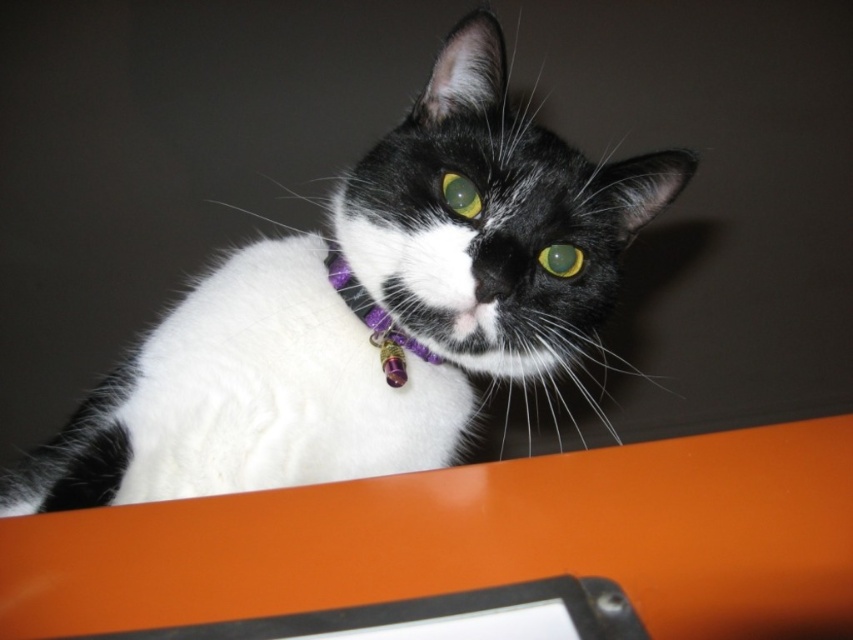
Question: Does orange glossy table at upper center appear on the left side of green glossy eye at center?

Choices:
 (A) yes
 (B) no

Answer: (A)

Question: Is white fur cat at center thinner than purple fabric collar at center?

Choices:
 (A) no
 (B) yes

Answer: (A)

Question: Which object is farther from the camera taking this photo?

Choices:
 (A) purple fabric collar at center
 (B) white fur cat at center

Answer: (A)

Question: Estimate the real-world distances between objects in this image. Which object is farther from the green glossy eye at center?

Choices:
 (A) shiny green eye at upper center
 (B) purple fabric collar at center
 (C) orange glossy table at upper center
 (D) white fur cat at center

Answer: (C)

Question: Which point is closer to the camera?

Choices:
 (A) (299, 268)
 (B) (575, 269)
 (C) (407, 337)
 (D) (444, 177)

Answer: (D)

Question: Can you confirm if white fur cat at center is positioned to the right of purple fabric collar at center?

Choices:
 (A) no
 (B) yes

Answer: (A)